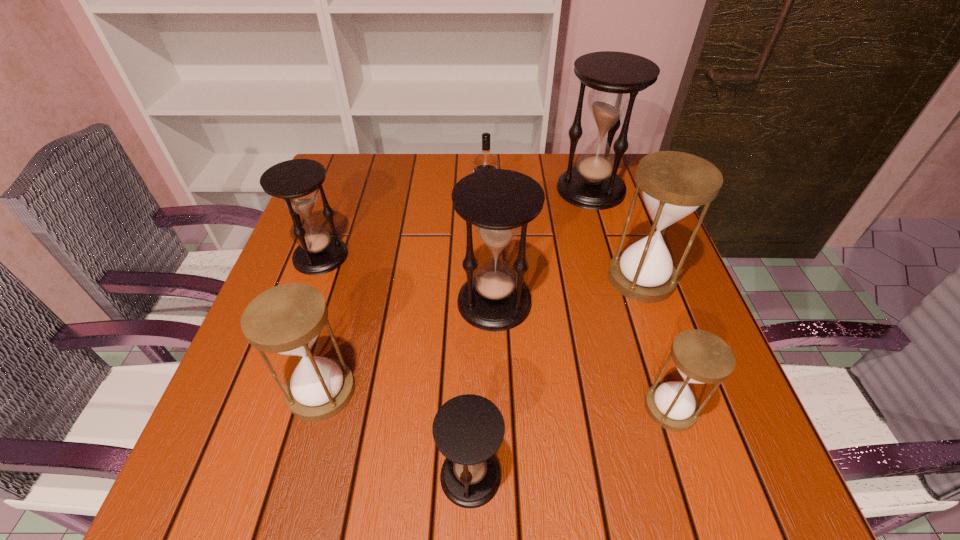
I want to click on free location that satisfies the following two spatial constraints: 1. on the front side of the third smallest black hourglass; 2. on the left side of the smallest white hourglass, so click(497, 408).

Image resolution: width=960 pixels, height=540 pixels. I want to click on vacant space that satisfies the following two spatial constraints: 1. on the label of the second biggest black hourglass; 2. on the left side of the vodka, so click(x=487, y=302).

Where is `vacant space that satisfies the following two spatial constraints: 1. on the label of the vodka; 2. on the right side of the third smallest black hourglass`? This screenshot has width=960, height=540. vacant space that satisfies the following two spatial constraints: 1. on the label of the vodka; 2. on the right side of the third smallest black hourglass is located at coordinates (487, 302).

You are a GUI agent. You are given a task and a screenshot of the screen. Output one action in this format:
    pyautogui.click(x=<x>, y=<y>)
    Task: Click on the free point that satisfies the following two spatial constraints: 1. on the back side of the second biggest black hourglass; 2. on the right side of the farthest white hourglass
    The width and height of the screenshot is (960, 540).
    Given the screenshot: What is the action you would take?
    pyautogui.click(x=493, y=278)